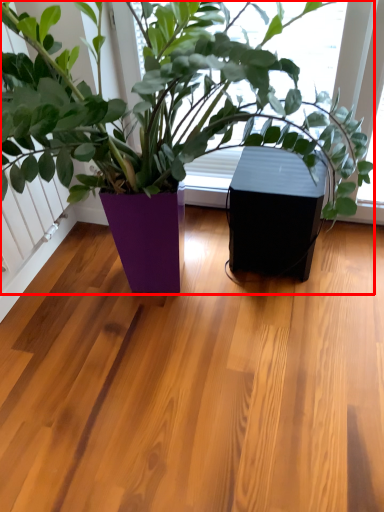
Question: Where is houseplant (annotated by the red box) located in relation to window box in the image?

Choices:
 (A) right
 (B) left

Answer: (B)